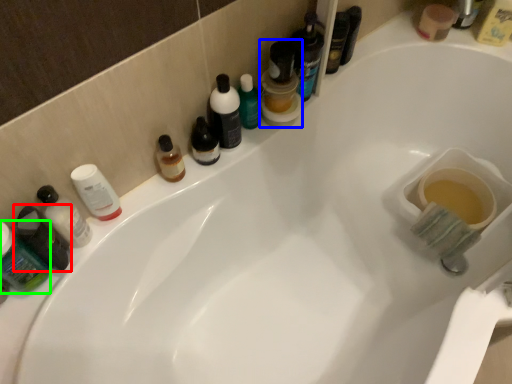
Question: Considering the real-world distances, which object is closest to toiletry (highlighted by a red box)? mouthwash (highlighted by a blue box) or mouthwash (highlighted by a green box).

Choices:
 (A) mouthwash
 (B) mouthwash

Answer: (B)